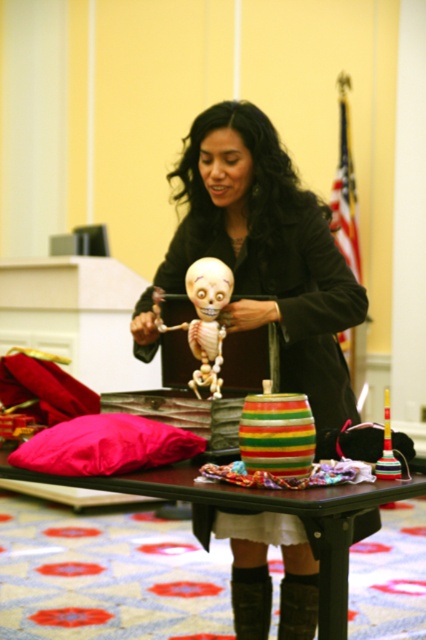
Question: Which object appears closest to the camera in this image?

Choices:
 (A) matte black jacket at center
 (B) black leather boot at lower center

Answer: (A)

Question: Can you confirm if striped wooden table at center is positioned above leather at lower center?

Choices:
 (A) no
 (B) yes

Answer: (B)

Question: Which of the following is the closest to the observer?

Choices:
 (A) striped wooden table at center
 (B) matte black jacket at center

Answer: (A)

Question: Is black leather boot at lower center closer to camera compared to leather at lower center?

Choices:
 (A) no
 (B) yes

Answer: (A)

Question: Which point is closer to the camera?

Choices:
 (A) (164, 472)
 (B) (317, 236)
 (C) (209, 333)
 (D) (301, 625)

Answer: (A)

Question: Is smooth beige skeleton at center positioned behind black leather boot at lower center?

Choices:
 (A) no
 (B) yes

Answer: (A)